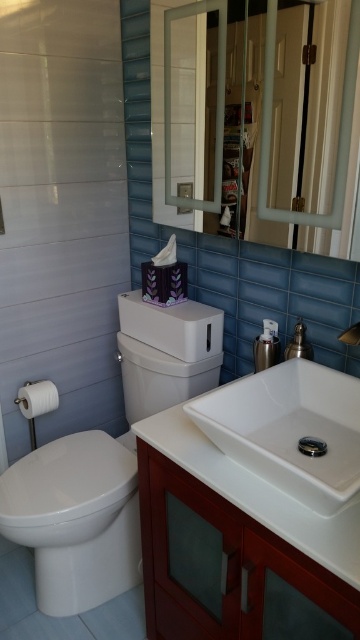
Question: Is white glossy toilet bowl at lower left thinner than polished chrome faucet at upper right?

Choices:
 (A) no
 (B) yes

Answer: (A)

Question: Among these objects, which one is nearest to the camera?

Choices:
 (A) white glossy toilet bowl at lower left
 (B) white glossy sink at center
 (C) polished chrome faucet at upper right
 (D) white glossy toilet bowl at left

Answer: (B)

Question: Is white glossy toilet bowl at lower left above white matte toilet paper at lower left?

Choices:
 (A) yes
 (B) no

Answer: (B)

Question: Considering the real-world distances, which object is closest to the white glossy toilet bowl at lower left?

Choices:
 (A) white glossy sink at center
 (B) white glossy toilet bowl at left

Answer: (B)

Question: Is clear glass mirror at upper center smaller than polished chrome faucet at upper right?

Choices:
 (A) no
 (B) yes

Answer: (A)

Question: Considering the real-world distances, which object is farthest from the polished chrome faucet at upper right?

Choices:
 (A) mahogany wood vanity at lower right
 (B) white glossy toilet bowl at lower left
 (C) satin nickel faucet at sink right
 (D) white matte toilet paper at lower left

Answer: (D)